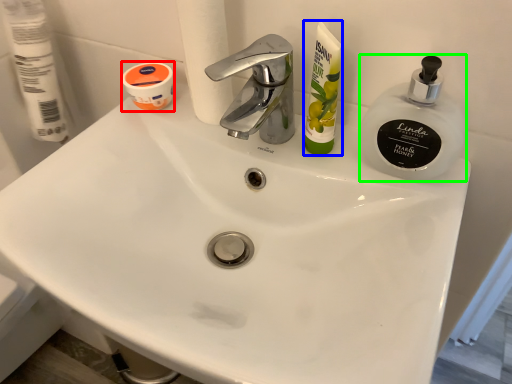
Question: Which is farther away from mouthwash (highlighted by a red box)? toiletry (highlighted by a blue box) or soap dispenser (highlighted by a green box)?

Choices:
 (A) toiletry
 (B) soap dispenser

Answer: (B)